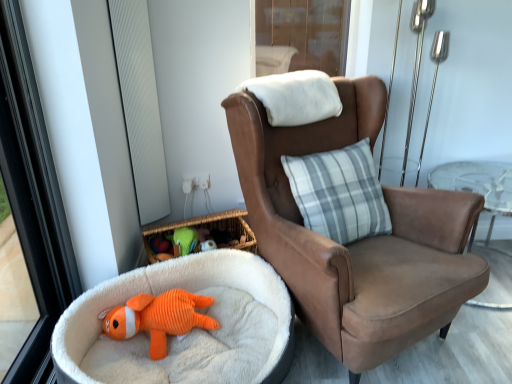
Question: In terms of size, does transparent glass screen door at upper center appear bigger or smaller than orange corduroy dog bed at lower left?

Choices:
 (A) small
 (B) big

Answer: (A)

Question: In the image, is transparent glass screen door at upper center on the left side or the right side of orange corduroy dog bed at lower left?

Choices:
 (A) left
 (B) right

Answer: (B)

Question: Which of these objects is positioned farthest from the transparent glass screen door at upper center?

Choices:
 (A) orange corduroy fish at lower left, arranged as the 1th toy when ordered from the bottom
 (B) brown suede chair at center
 (C) orange corduroy dog bed at lower left
 (D) green corduroy toy at center, placed as the 1th toy when sorted from back to front
 (E) white textured window screen at left

Answer: (A)

Question: Which object is positioned farthest from the orange corduroy dog bed at lower left?

Choices:
 (A) white textured window screen at left
 (B) orange corduroy fish at lower left, arranged as the 1th toy when ordered from the bottom
 (C) transparent glass screen door at upper center
 (D) brown suede chair at center
 (E) green corduroy toy at center, placed as the 2th toy when sorted from front to back

Answer: (C)